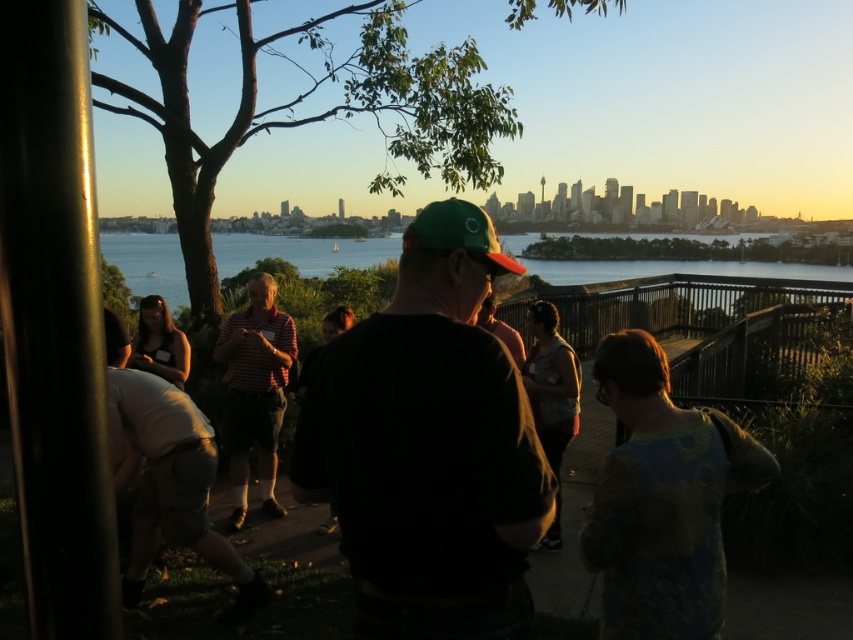
Looking at this image, you are standing at the overlook and want to take a photo of the striped cotton shirt at center without moving. Can you reach it with your camera if your camera has a maximum zoom range of 10 meters?

The striped cotton shirt at center is 5.80 meters away from the viewer. Since your camera can zoom up to 10 meters, you can capture the striped cotton shirt at center clearly without moving.

You are a photographer trying to capture a shot of the striped cotton shirt at center and the green fabric baseball cap at center. Which object should you focus on first if you want to ensure both are in focus without adjusting the camera settings?

The striped cotton shirt at center is much taller than the green fabric baseball cap at center, so focusing on the striped cotton shirt at center first would ensure both are in focus as it is the farther object.